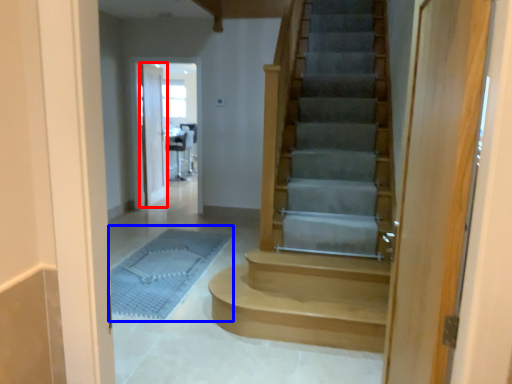
Question: Which point is further to the camera, door (highlighted by a red box) or bath mat (highlighted by a blue box)?

Choices:
 (A) door
 (B) bath mat

Answer: (A)